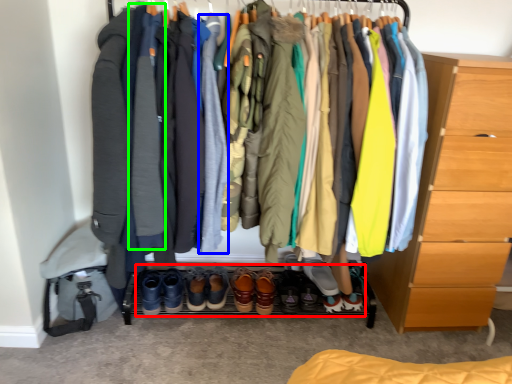
Question: Considering the real-world distances, which object is farthest from footwear (highlighted by a red box)? robe (highlighted by a blue box) or robe (highlighted by a green box)?

Choices:
 (A) robe
 (B) robe

Answer: (B)